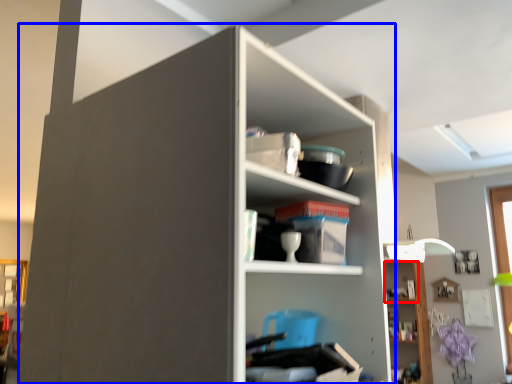
Question: Which of the following is the closest to the observer, cabinet (highlighted by a red box) or shelf (highlighted by a blue box)?

Choices:
 (A) cabinet
 (B) shelf

Answer: (B)